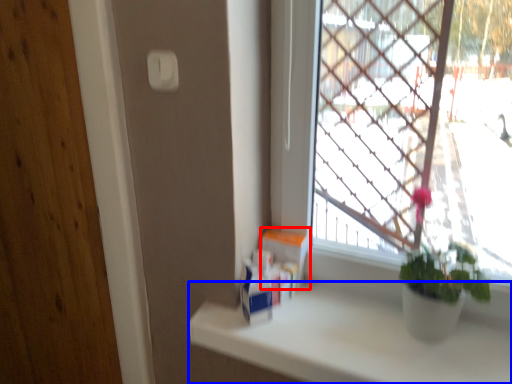
Question: Which point is further to the camera, window box (highlighted by a red box) or counter top (highlighted by a blue box)?

Choices:
 (A) window box
 (B) counter top

Answer: (A)